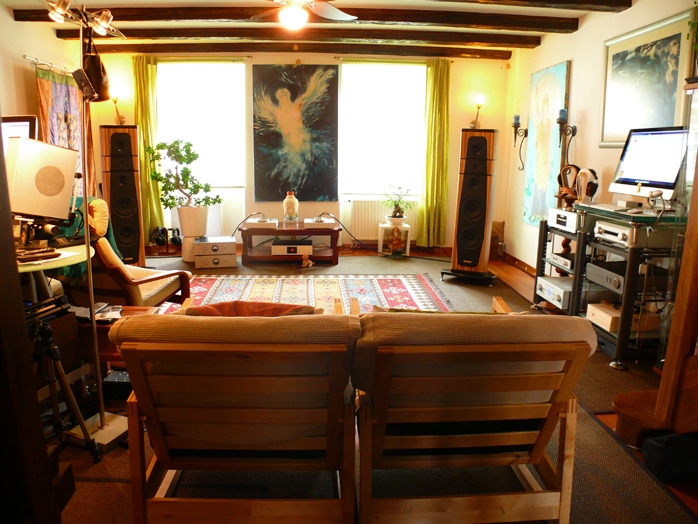
Find the location of a particular element. The image size is (698, 524). window is located at coordinates (200, 89), (378, 92).